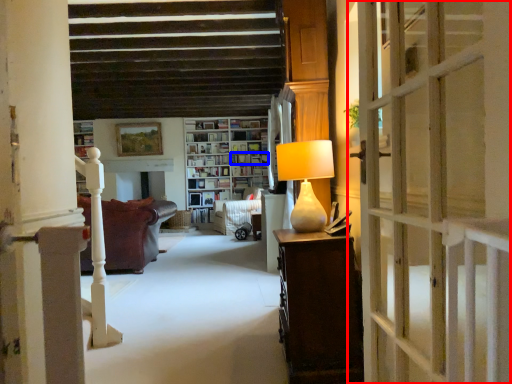
Question: Which object is closer to the camera taking this photo, door (highlighted by a red box) or shelf (highlighted by a blue box)?

Choices:
 (A) door
 (B) shelf

Answer: (A)